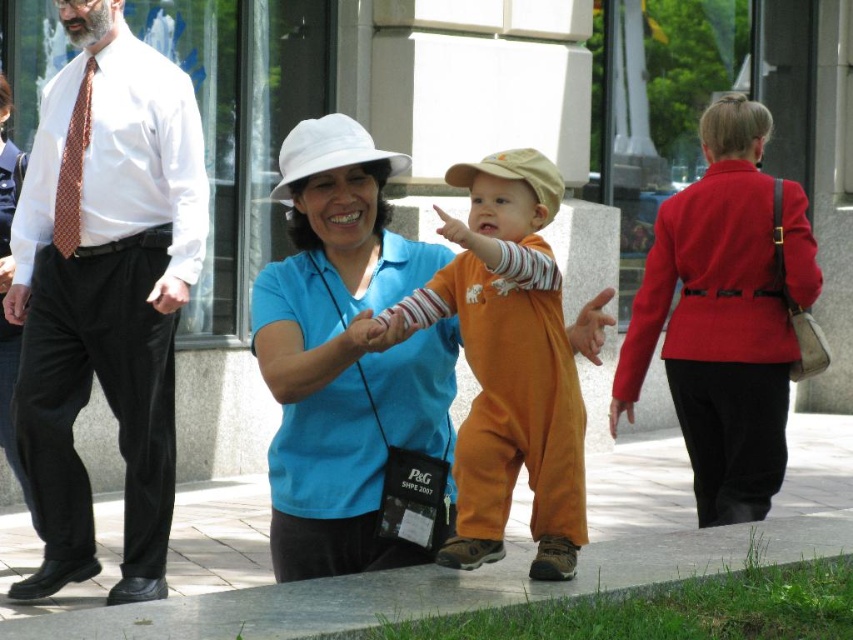
You are organizing a costume party and need to choose between the orange cotton jumpsuit at center and the matte orange jumpsuit at center. Which one is smaller in size?

The orange cotton jumpsuit at center is smaller in size compared to the matte orange jumpsuit at center.

In the scene described, there is a woman wearing a matte brown tie at left and a child in an orange cotton jumpsuit at center. Which of these two items is positioned more to the left side of the image?

The matte brown tie at left is positioned to the left of the orange cotton jumpsuit at center, so the matte brown tie at left is more to the left.

You are standing at the edge of the paved stone sidewalk at center and want to hand a leaflet to the person wearing the orange cotton jumpsuit at center. Which direction should you move to reach them?

The paved stone sidewalk at center is below the orange cotton jumpsuit at center, so you should move upward to reach the person wearing the orange cotton jumpsuit at center.